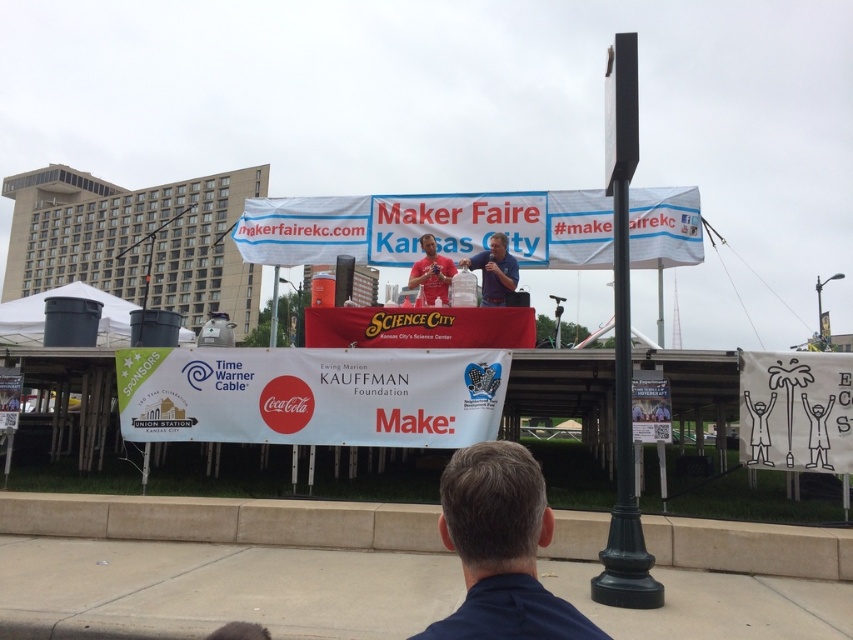
You are an attendee at the Maker Faire Kansas City event. You want to take a photo of the dark blue shirt at lower center and the green painted metal pole at center. Which object will appear smaller in your photo?

The dark blue shirt at lower center occupies less space than the green painted metal pole at center, so it will appear smaller in the photo.

You are setting up for an event and need to determine which object is shorter between the white paper banner at lower right and the metallic pole at center. Based on the scene description, which one is shorter?

The white paper banner at lower right is shorter than the metallic pole at center.

You are standing at the entrance of the Maker Faire Kansas City event. You see a green painted metal pole at center and a metallic pole at center. Which pole is farther from you?

The green painted metal pole at center is 48.18 feet away from the metallic pole at center, so the metallic pole at center is closer to you, making the green painted metal pole at center the farther one.